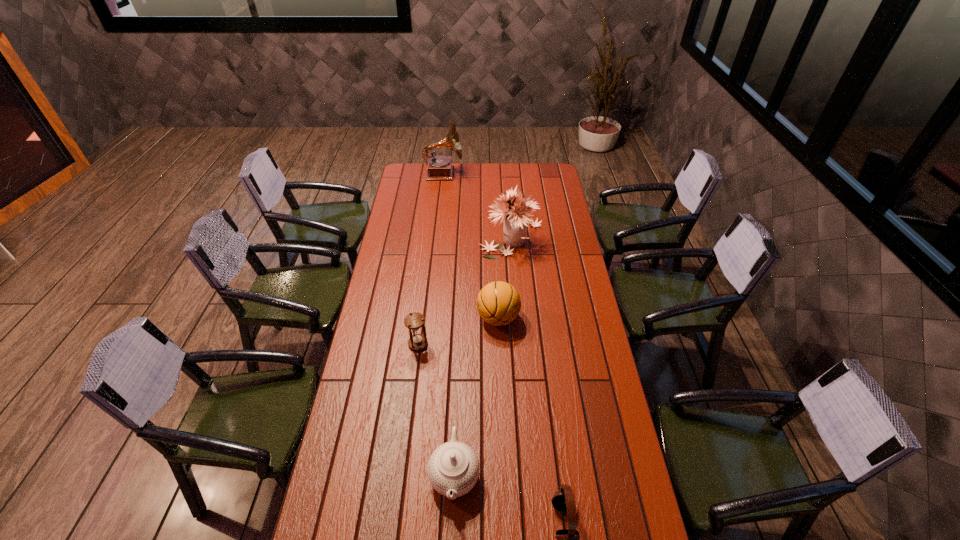
Locate an element on the screen. free space between the fourth farthest object and the farthest object is located at coordinates (431, 259).

What are the coordinates of `empty space between the phonograph_record and the hourglass` in the screenshot? It's located at (431, 259).

This screenshot has height=540, width=960. I want to click on vacant region between the fourth nearest object and the bouquet, so [505, 277].

Locate an element on the screen. This screenshot has width=960, height=540. vacant space in between the farthest object and the second farthest object is located at coordinates [x=478, y=205].

I want to click on free space between the farthest object and the fifth nearest object, so (478, 205).

Where is `free space between the phonograph_record and the hourglass`? The height and width of the screenshot is (540, 960). free space between the phonograph_record and the hourglass is located at coordinates (431, 259).

The width and height of the screenshot is (960, 540). What are the coordinates of `blank region between the basketball and the chinaware` in the screenshot? It's located at (476, 396).

Identify the location of object that is the third closest one to the headset. Image resolution: width=960 pixels, height=540 pixels. (414, 321).

Identify the location of object that ranks as the fourth closest to the fourth nearest object. This screenshot has width=960, height=540. (568, 539).